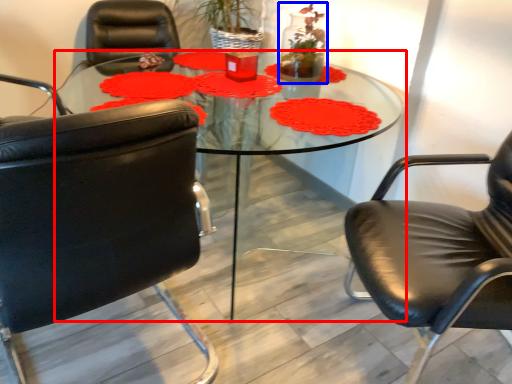
Question: Which object is further to the camera taking this photo, coffee table (highlighted by a red box) or floral arrangement (highlighted by a blue box)?

Choices:
 (A) coffee table
 (B) floral arrangement

Answer: (B)